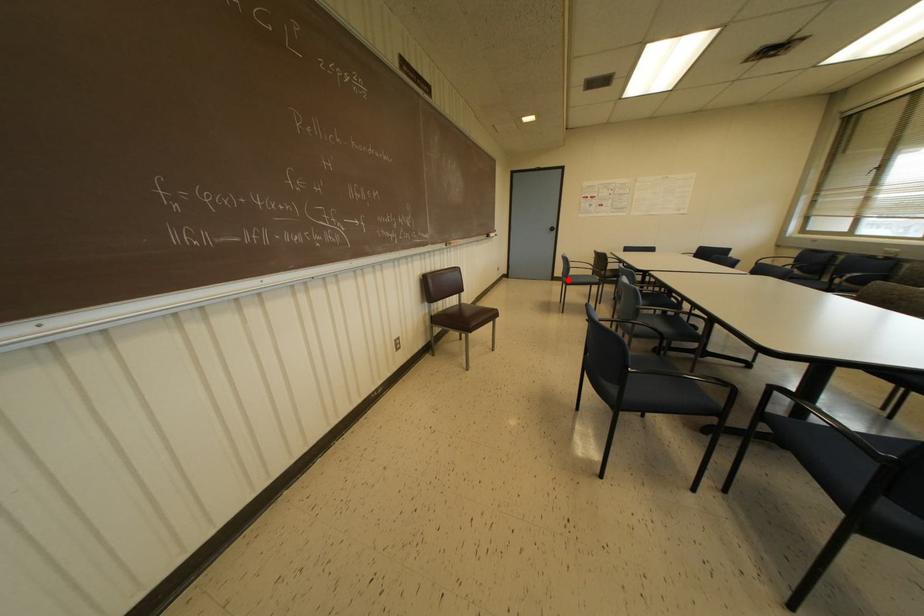
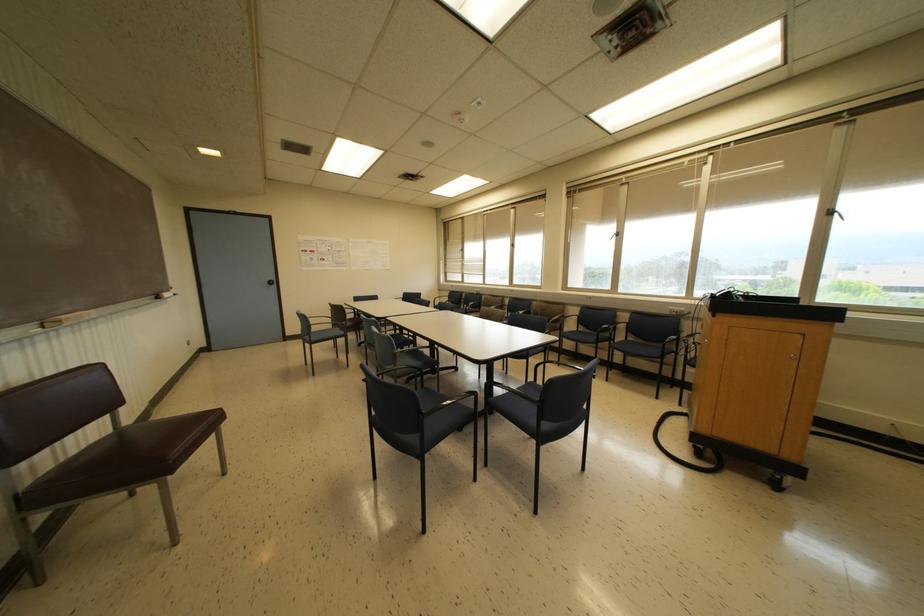
Where in the second image is the point corresponding to the highlighted location from the first image?

(312, 338)